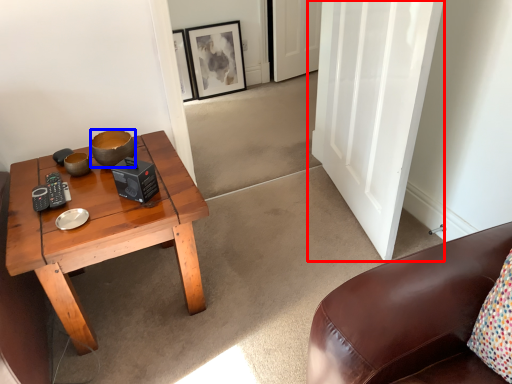
Question: Which object appears closest to the camera in this image, door (highlighted by a red box) or bowl (highlighted by a blue box)?

Choices:
 (A) door
 (B) bowl

Answer: (A)